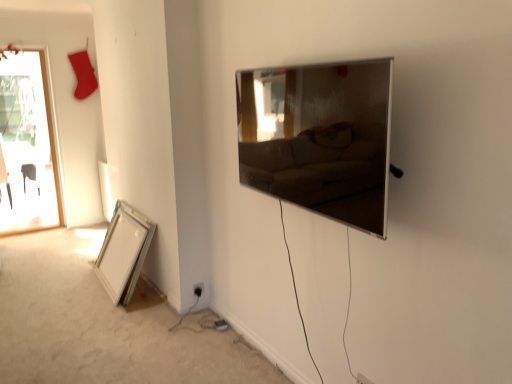
Question: Considering the positions of black plastic electric outlet at lower center, the first electric outlet positioned from the top, and silver metallic picture frame at lower left, which is counted as the second picture frame, starting from the right, in the image, is black plastic electric outlet at lower center, the first electric outlet positioned from the top, wider or thinner than silver metallic picture frame at lower left, which is counted as the second picture frame, starting from the right,?

Choices:
 (A) wide
 (B) thin

Answer: (B)

Question: From the image's perspective, is black plastic electric outlet at lower center, the 1th electric outlet when ordered from left to right, positioned above or below silver metallic picture frame at lower left, which ranks as the 2th picture frame in top-to-bottom order?

Choices:
 (A) below
 (B) above

Answer: (A)

Question: Which is farther from the black plastic electric outlet at lower center, which ranks as the second electric outlet in bottom-to-top order?

Choices:
 (A) white plastic electric outlet at lower center, which is counted as the 2th electric outlet, starting from the top
 (B) satin silver tv at upper right, which is counted as the 2th picture frame, starting from the back
 (C) silver metallic picture frame at lower left, positioned as the second picture frame in front-to-back order

Answer: (B)

Question: Based on their relative distances, which object is nearer to the silver metallic picture frame at lower left, positioned as the second picture frame in front-to-back order?

Choices:
 (A) white plastic electric outlet at lower center, the second electric outlet viewed from the back
 (B) satin silver tv at upper right, which is counted as the 1th picture frame, starting from the right
 (C) black plastic electric outlet at lower center, arranged as the 1th electric outlet when viewed from the back

Answer: (C)